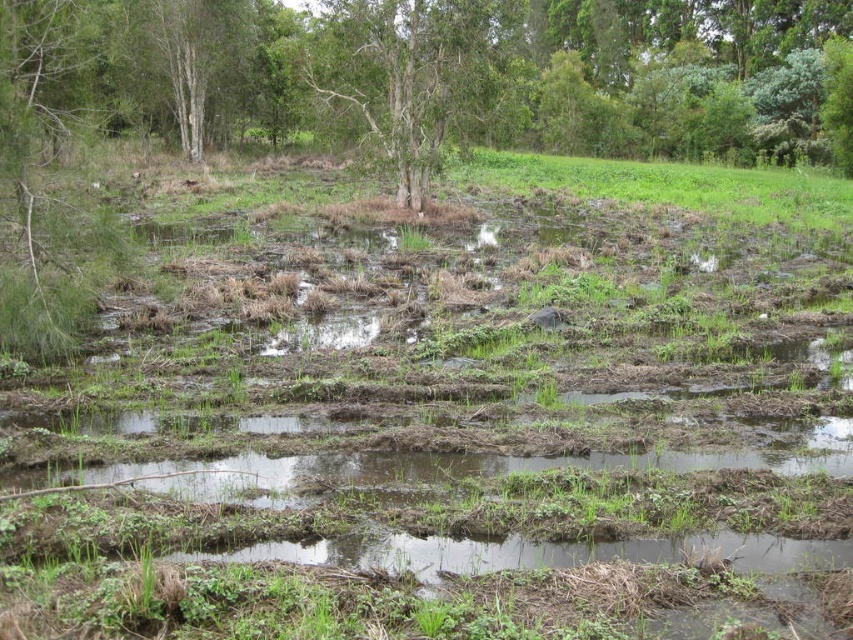
You are a hiker trying to cross the wetland area. You notice the green matte tree at left and the green leafy tree at center. Which tree is positioned lower in the image?

The green matte tree at left is located below the green leafy tree at center, so it is positioned lower in the image.

You are navigating a small drone through the wetland area shown in the image. Your path must go from the point at the bottom left to the point at the top right. There are two points of interest marked as point 1 at coordinates point (x=519, y=77) and point 2 at coordinates point (x=314, y=29). Since you want to avoid obstacles, you need to know which point is closer to your starting position. Which point is closer to the starting point?

Point (x=314, y=29) is closer to the starting position because it is in front of point (x=519, y=77), meaning it is nearer to the observer.

You are standing at the point with coordinates point (45, 184) in the wetland scene. What object is located at that point?

The point (45, 184) indicates a green matte tree at left.